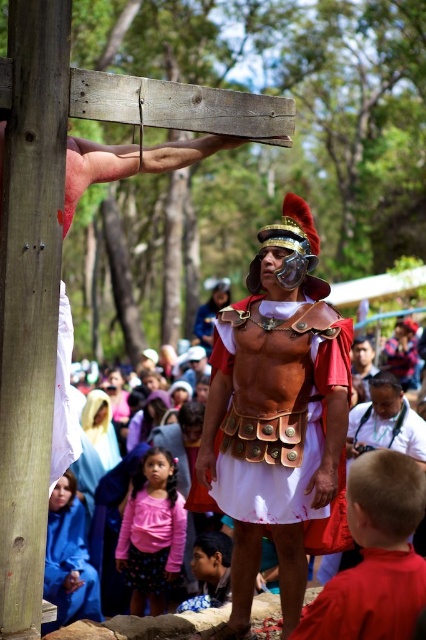
You are an observer standing in front of the scene. There is a matte gold armor at center and a smooth wood post at left. Which object is closer to your right side?

The matte gold armor at center is positioned on the right side of smooth wood post at left, so from your perspective, the matte gold armor at center is closer to your right side.

Based on the coordinates provided, where is the pink fabric shirt at center located in the image?

The pink fabric shirt at center is located at the coordinates point (152, 532).

You are a photographer trying to capture the central figure in the matte gold armor at center and the cross at the smooth wood post at left in the same frame. Based on their positions, which object should appear lower in the photo?

The matte gold armor at center appears lower in the photo because it is located below the smooth wood post at left.